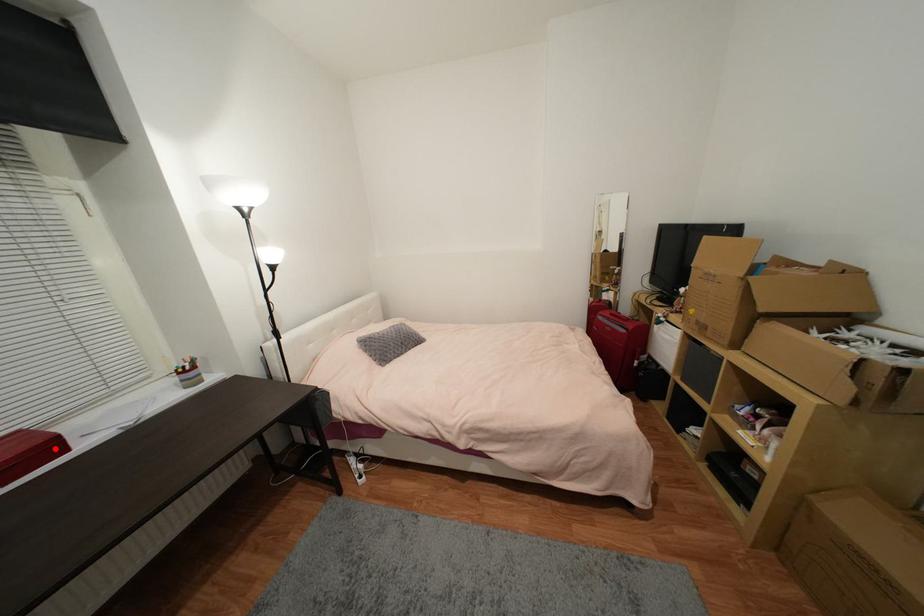
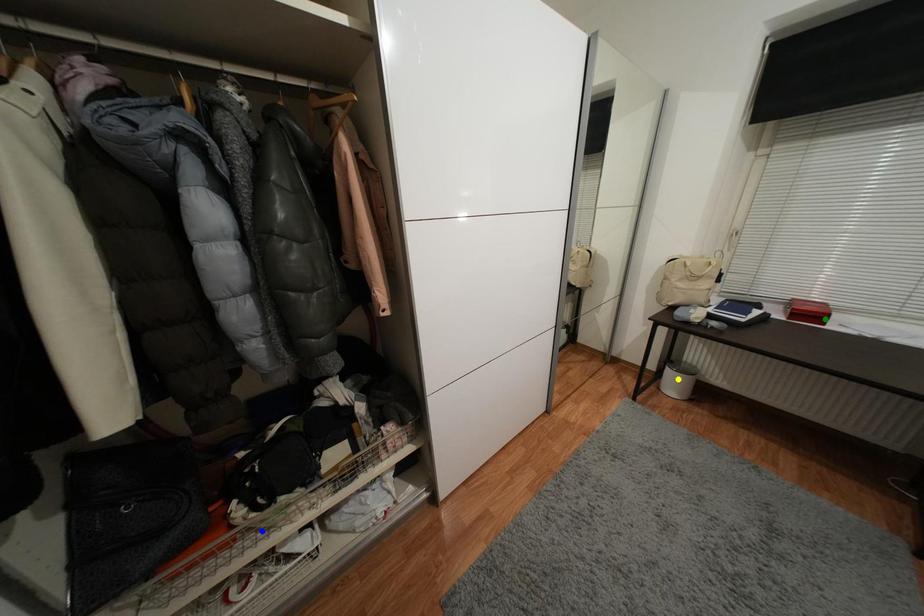
Question: I am providing you with two images of the same scene from different viewpoints. A red point is marked on the first image. You are given multiple points on the second image. Which point in image 2 is actually the same real-world point as the red point in image 1?

Choices:
 (A) yellow point
 (B) green point
 (C) blue point

Answer: (B)